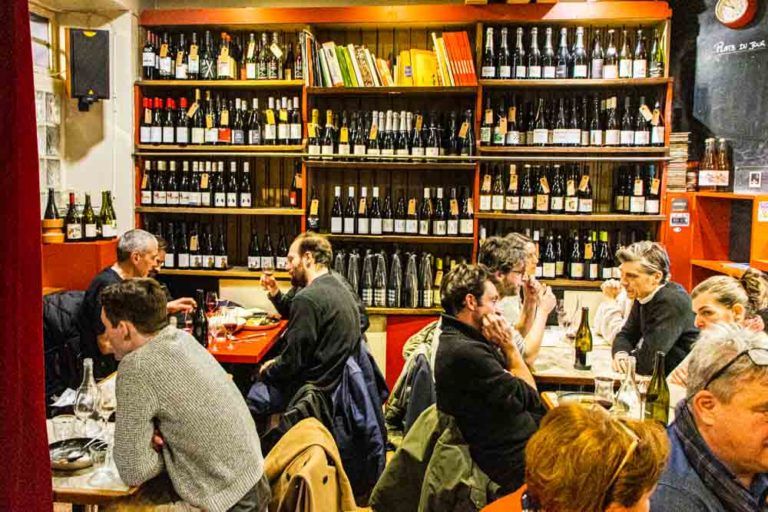
Where is `table`? table is located at coordinates (247, 340), (103, 483), (541, 358).